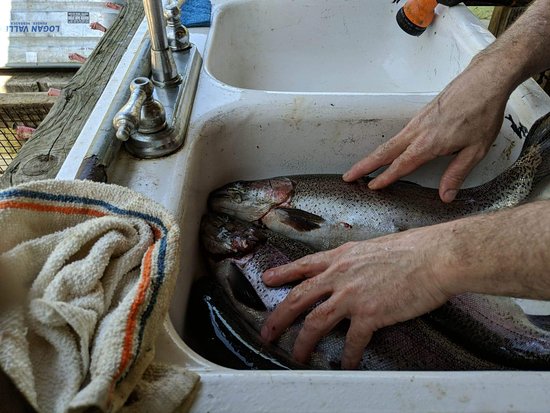
The image size is (550, 413). What are the coordinates of `dirty rag` in the screenshot? It's located at (60, 312).